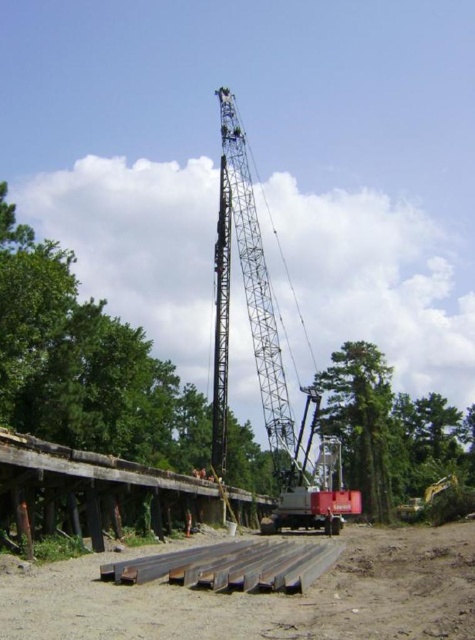
Is metallic gray crane at center further to camera compared to metal at lower center?

Yes, metallic gray crane at center is behind metal at lower center.

Can you confirm if metallic gray crane at center is shorter than metal at lower center?

No, metallic gray crane at center is not shorter than metal at lower center.

Between point (218, 348) and point (339, 554), which one is positioned in front?

Point (339, 554)

Locate an element on the screen. Image resolution: width=475 pixels, height=640 pixels. metallic gray crane at center is located at coordinates (247, 305).

Does metal beams at lower center come behind green rough bark tree at center?

No, it is in front of green rough bark tree at center.

Who is lower down, metal beams at lower center or green rough bark tree at center?

green rough bark tree at center

Where is `metal beams at lower center`? The image size is (475, 640). metal beams at lower center is located at coordinates (262, 595).

Does point (19, 451) lie behind point (262, 556)?

No, (19, 451) is in front of (262, 556).

I want to click on metal beams at lower center, so click(x=262, y=595).

Which is in front, point (446, 566) or point (241, 589)?

Point (241, 589) is in front.

The width and height of the screenshot is (475, 640). Find the location of `metal beams at lower center`. metal beams at lower center is located at coordinates (262, 595).